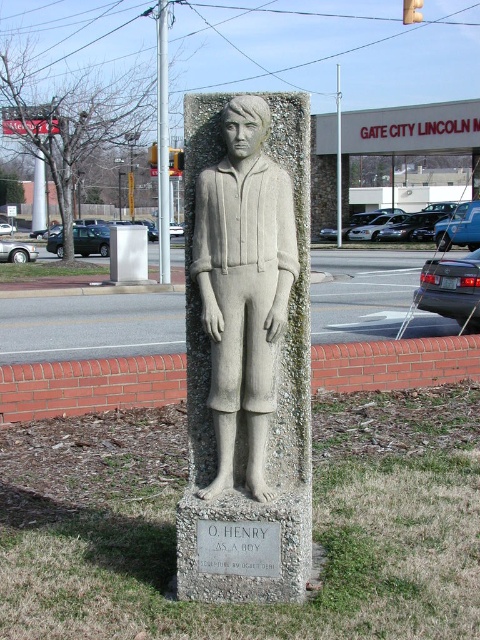
Looking at this image, between gray stone statue at center and gray stone plaque at center, which one has more height?

With more height is gray stone statue at center.

Who is more forward, (297, 387) or (278, 557)?

Point (278, 557) is in front.

Is point (214, 342) farther from viewer compared to point (247, 557)?

Yes, point (214, 342) is behind point (247, 557).

Locate an element on the screen. gray stone statue at center is located at coordinates (247, 349).